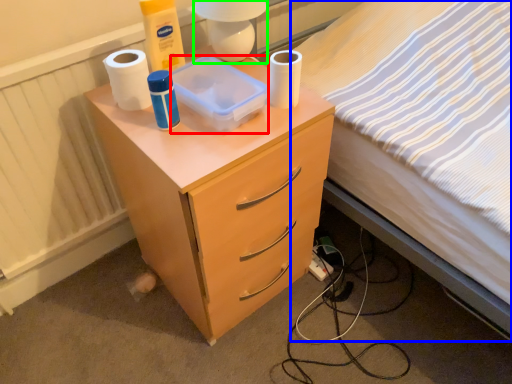
Question: Estimate the real-world distances between objects in this image. Which object is closer to box (highlighted by a red box), bed (highlighted by a blue box) or lamp (highlighted by a green box)?

Choices:
 (A) bed
 (B) lamp

Answer: (B)